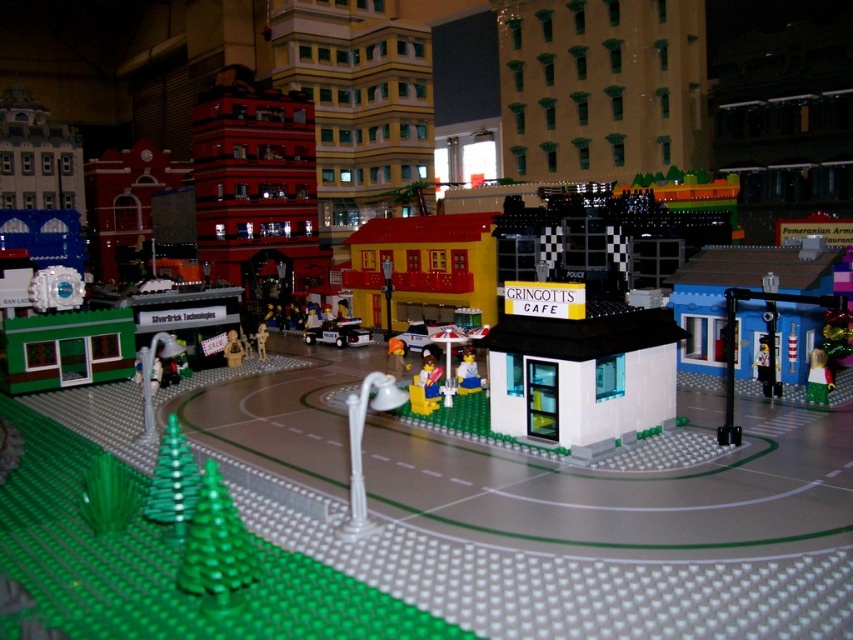
Is translucent plastic figure at center to the right of matte plastic figure at center from the viewer's perspective?

Incorrect, translucent plastic figure at center is not on the right side of matte plastic figure at center.

Is translucent plastic figure at center thinner than matte plastic figure at center?

Yes.

Is point (227, 336) positioned after point (258, 355)?

No, (227, 336) is closer to viewer.

Locate an element on the screen. The image size is (853, 640). translucent plastic figure at center is located at coordinates (233, 349).

Can you confirm if white plastic street lamp at center is positioned above translucent yellow figure at center?

No.

Does point (381, 388) come in front of point (460, 369)?

Yes, it is in front of point (460, 369).

Where is `white plastic street lamp at center`? This screenshot has width=853, height=640. white plastic street lamp at center is located at coordinates (360, 445).

Does green matte christmas tree at lower left appear on the right side of translucent yellow figure at center?

No, green matte christmas tree at lower left is not to the right of translucent yellow figure at center.

Describe the element at coordinates (173, 483) in the screenshot. I see `green matte christmas tree at lower left` at that location.

This screenshot has width=853, height=640. Find the location of `green matte christmas tree at lower left`. green matte christmas tree at lower left is located at coordinates (173, 483).